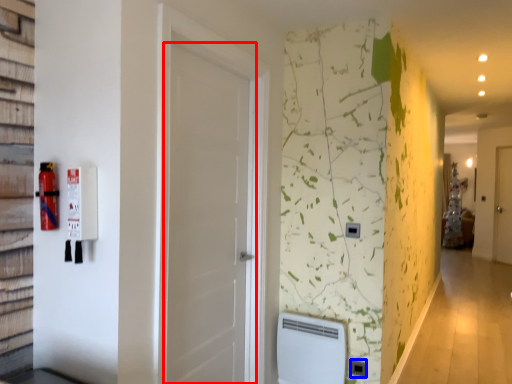
Question: Among these objects, which one is farthest to the camera, door (highlighted by a red box) or electric outlet (highlighted by a blue box)?

Choices:
 (A) door
 (B) electric outlet

Answer: (B)